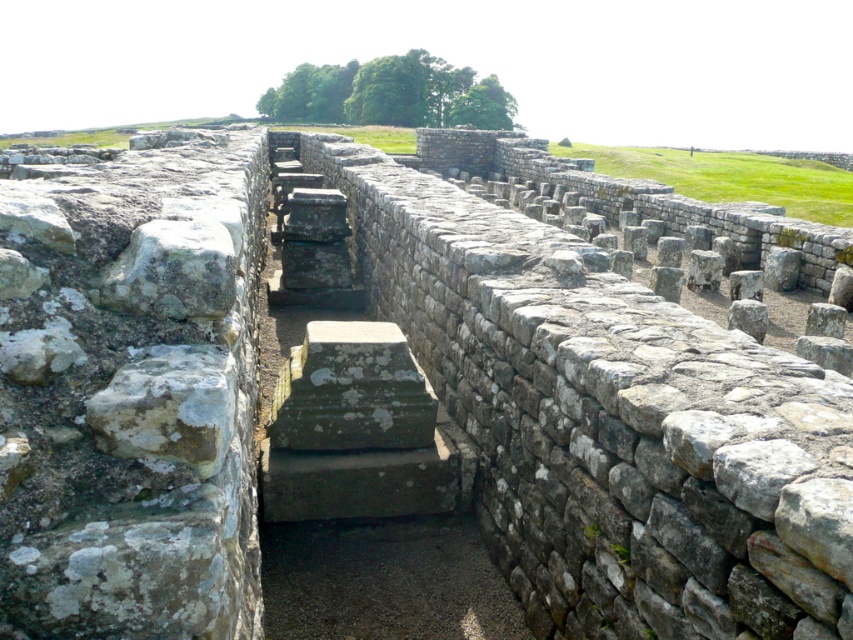
Does gray stone stairs at center appear on the left side of weathered stone at left?

Correct, you'll find gray stone stairs at center to the left of weathered stone at left.

How distant is gray stone stairs at center from weathered stone at left?

gray stone stairs at center and weathered stone at left are 2.72 meters apart.

Identify the location of gray stone stairs at center. (357, 432).

In the scene shown: Which of these two, weathered stone wall at left or gray stone stairs at center, stands shorter?

Standing shorter between the two is weathered stone wall at left.

Is point (152, 356) positioned in front of point (350, 378)?

Yes, point (152, 356) is closer to viewer.

Where is `weathered stone wall at left`? The image size is (853, 640). weathered stone wall at left is located at coordinates (131, 390).

Which is more to the right, weathered stone wall at left or weathered stone at left?

weathered stone at left is more to the right.

Locate an element on the screen. The height and width of the screenshot is (640, 853). weathered stone wall at left is located at coordinates (131, 390).